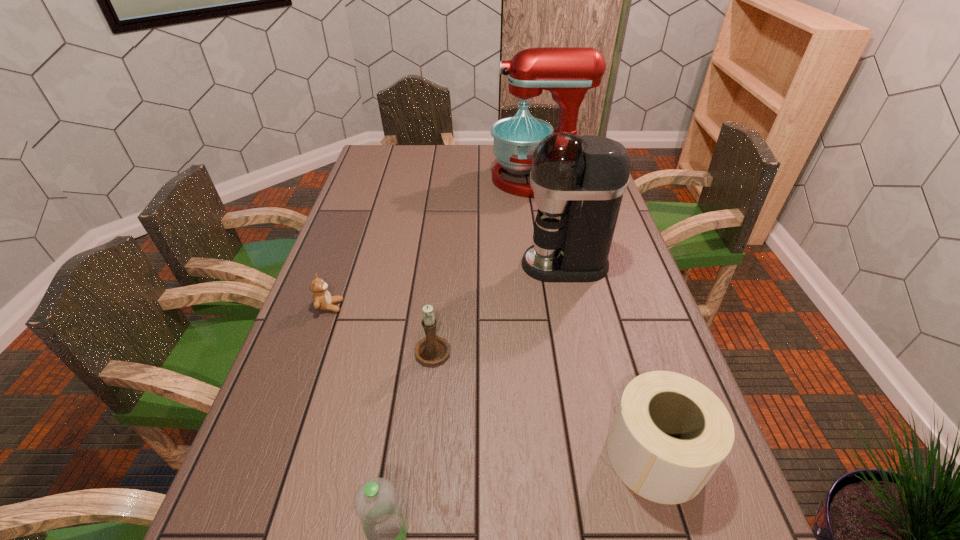
This screenshot has height=540, width=960. I want to click on free region located 0.180m place cup under the spout of the coffee maker, so click(461, 265).

Identify the location of vacant area situated place cup under the spout of the coffee maker. The image size is (960, 540). (393, 265).

Locate an element on the screen. The image size is (960, 540). vacant space situated place cup under the spout of the coffee maker is located at coordinates (426, 265).

The width and height of the screenshot is (960, 540). Find the location of `vacant space located 0.120m on the side of the third nearest object with the handle`. vacant space located 0.120m on the side of the third nearest object with the handle is located at coordinates (438, 299).

This screenshot has height=540, width=960. I want to click on vacant space located 0.390m on the side of the third nearest object with the handle, so click(x=444, y=239).

Where is `vacant area located on the side of the third nearest object with the handle`? Image resolution: width=960 pixels, height=540 pixels. vacant area located on the side of the third nearest object with the handle is located at coordinates (440, 281).

At what (x,y) coordinates should I click in order to perform the action: click on free region located on the back of the fifth farthest object. Please return your answer as a coordinate pair (x, y). Looking at the image, I should click on (605, 289).

The width and height of the screenshot is (960, 540). Identify the location of free spot located 0.190m on the front-facing side of the shortest object. tap(414, 307).

You are a GUI agent. You are given a task and a screenshot of the screen. Output one action in this format:
    pyautogui.click(x=<x>, y=<y>)
    Task: Click on the object that is at the far edge
    The width and height of the screenshot is (960, 540).
    Given the screenshot: What is the action you would take?
    pyautogui.click(x=567, y=72)

Locate an element on the screen. object located at the left edge is located at coordinates (322, 300).